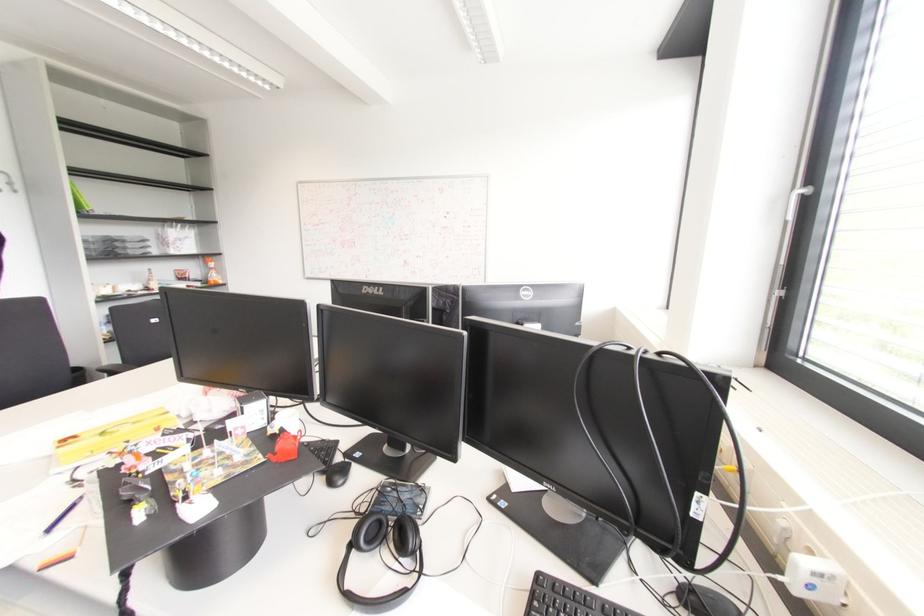
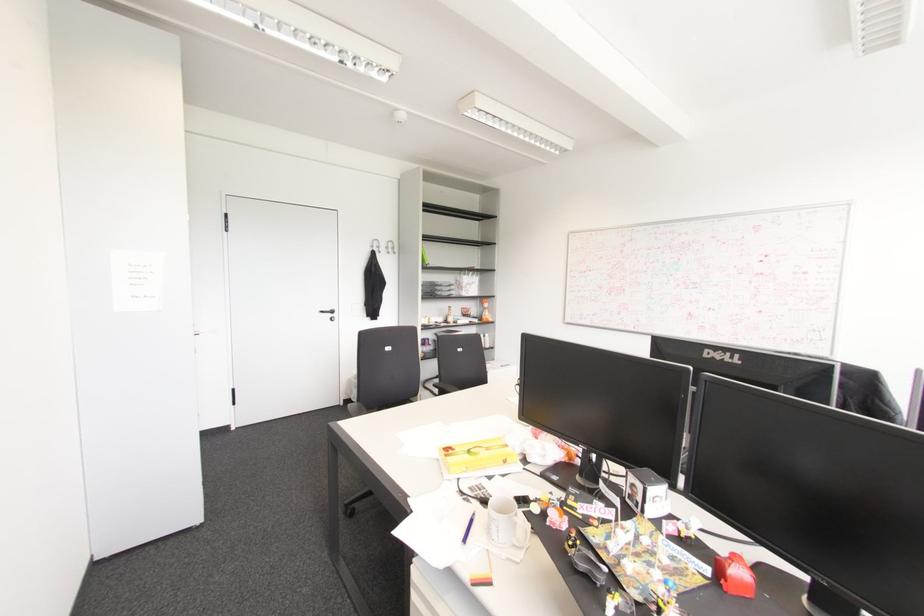
Question: I am providing you with two images of the same scene from different viewpoints. Which of the following objects are not visible in image2?

Choices:
 (A) black door handle
 (B) blue pen
 (C) small red toy
 (D) none of these

Answer: (D)